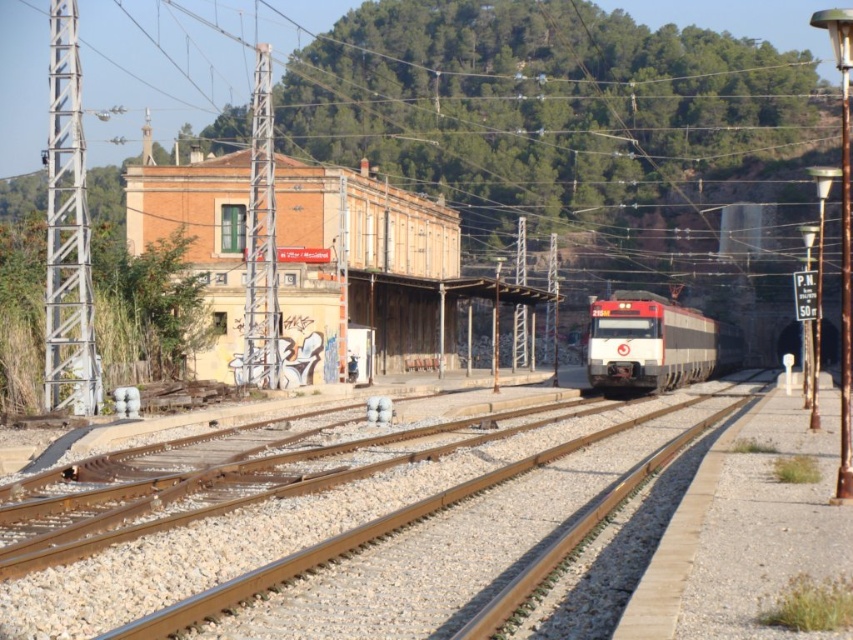
You are a train engineer approaching the station. Your train is on the right side of the frame. Where is the brick building at center in relation to your position?

The brick building at center is located at point 0.414 on the x axis and 0.436 on the y axis.

You are a photographer standing on the platform. You want to take a photo of the brick building at center without the brown metallic train track at center blocking the view. Is it possible to do so?

The brown metallic train track at center is in front of the brick building at center, so it will block the view. To capture the brick building at center without obstruction, you would need to position yourself where the track is not between you and the building.

You are a railway engineer checking the safety of the tracks. You notice the brown metallic train track at center and the red glossy train at center. Is there a risk of the train derailing due to track width?

The brown metallic train track at center is narrower than the red glossy train at center, so there is a risk of derailment because the track is not wide enough to support the train.